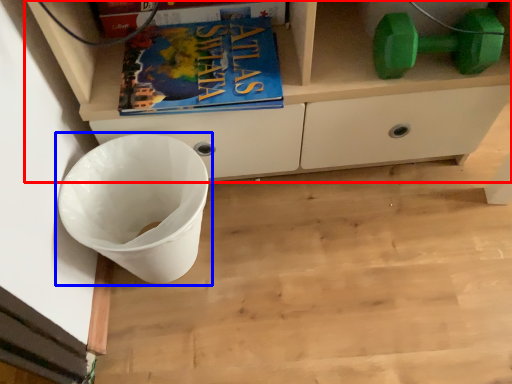
Question: Which of the following is the closest to the observer, cabinetry (highlighted by a red box) or waste container (highlighted by a blue box)?

Choices:
 (A) cabinetry
 (B) waste container

Answer: (A)